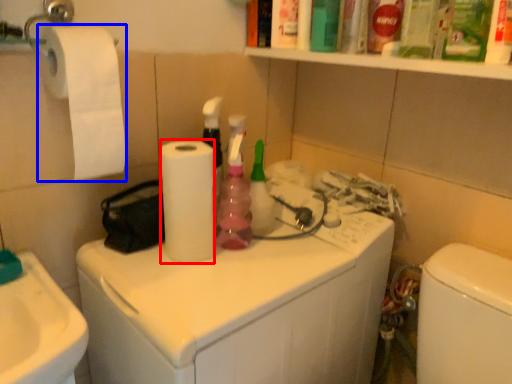
Question: Among these objects, which one is farthest to the camera, paper towel (highlighted by a red box) or toilet paper (highlighted by a blue box)?

Choices:
 (A) paper towel
 (B) toilet paper

Answer: (A)